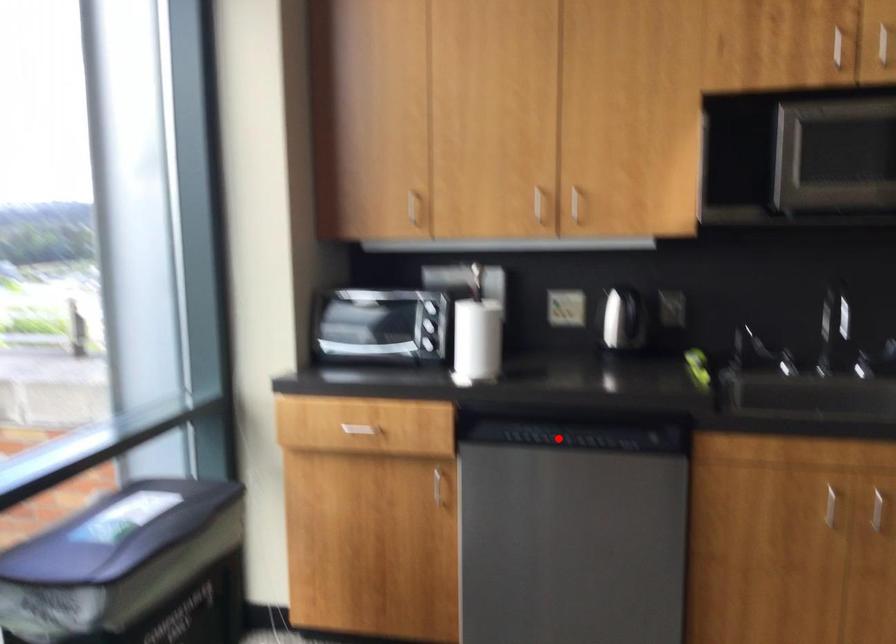
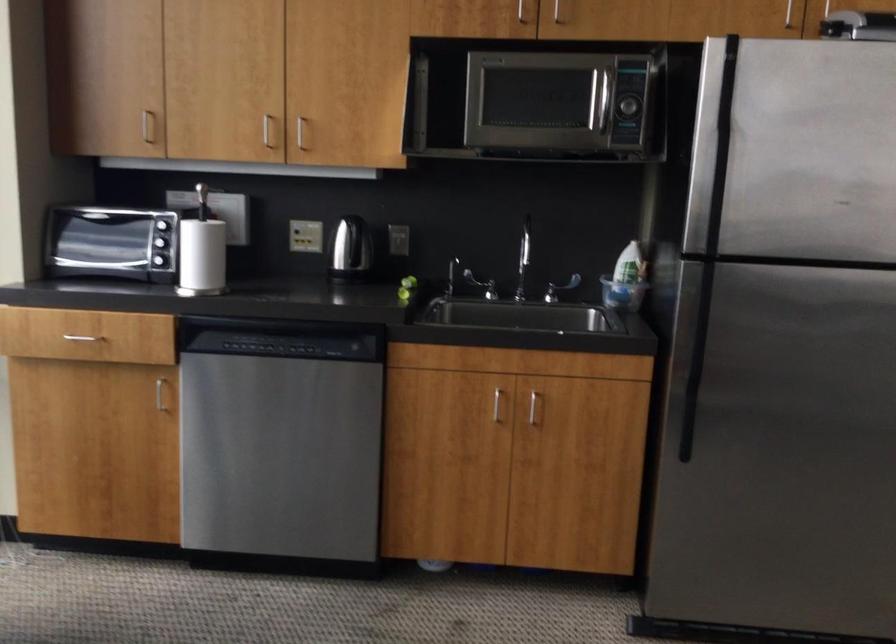
Question: I am providing you with two images of the same scene from different viewpoints. In image1, a red point is highlighted. Considering the same 3D point in image2, which of the following is correct?

Choices:
 (A) It is closer
 (B) It is farther

Answer: (B)